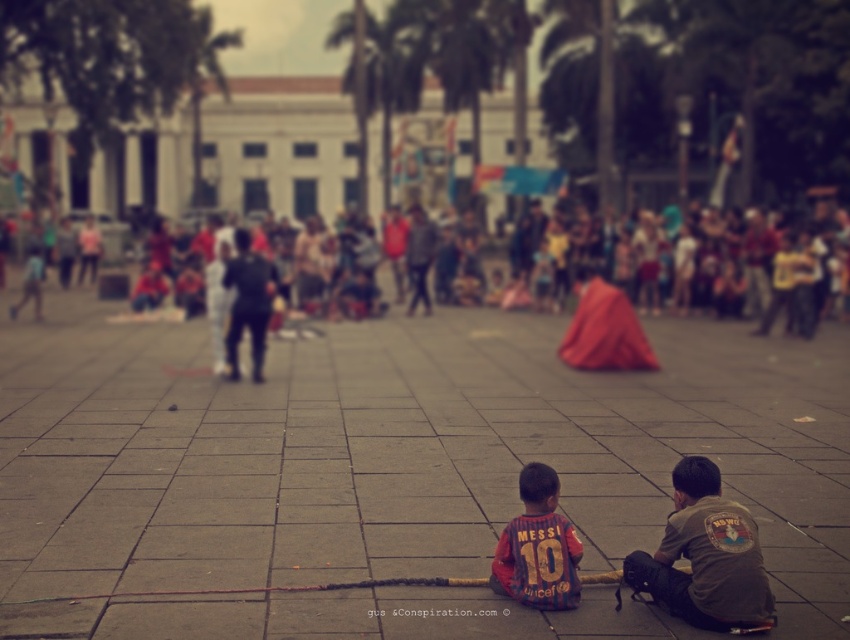
Which is more to the left, gray concrete pavement at center or brown cotton shirt at lower right?

Positioned to the left is gray concrete pavement at center.

Who is lower down, gray concrete pavement at center or brown cotton shirt at lower right?

brown cotton shirt at lower right

Is point (162, 456) in front of point (707, 596)?

That is False.

Where is `gray concrete pavement at center`? The height and width of the screenshot is (640, 850). gray concrete pavement at center is located at coordinates (394, 472).

Which is more to the left, blurred people at center or brown cotton shirt at lower right?

brown cotton shirt at lower right is more to the left.

Is blurred people at center shorter than brown cotton shirt at lower right?

No, blurred people at center is not shorter than brown cotton shirt at lower right.

What do you see at coordinates (714, 260) in the screenshot? Image resolution: width=850 pixels, height=640 pixels. I see `blurred people at center` at bounding box center [714, 260].

Where is `blurred people at center`? blurred people at center is located at coordinates 714,260.

Locate an element on the screen. Image resolution: width=850 pixels, height=640 pixels. gray concrete pavement at center is located at coordinates click(x=394, y=472).

Does point (768, 540) come behind point (638, 291)?

No, it is not.

Identify the location of gray concrete pavement at center. (394, 472).

I want to click on gray concrete pavement at center, so click(394, 472).